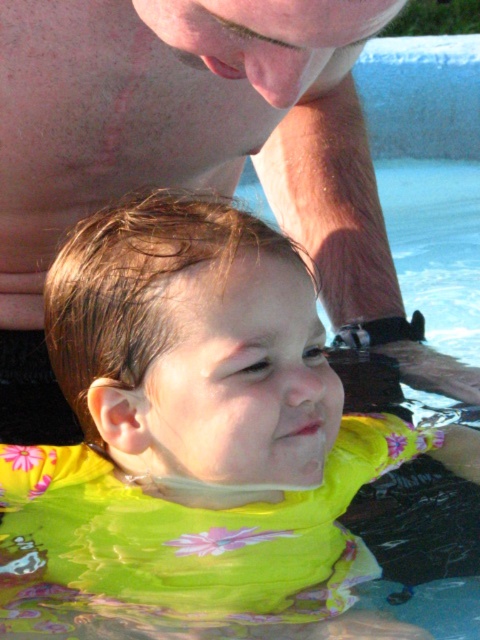
Question: Does yellow fabric float at center have a smaller size compared to pink skin at upper center?

Choices:
 (A) no
 (B) yes

Answer: (B)

Question: Can you confirm if yellow fabric float at center is smaller than pink skin at upper center?

Choices:
 (A) no
 (B) yes

Answer: (B)

Question: Which object appears closest to the camera in this image?

Choices:
 (A) yellow fabric float at center
 (B) pink skin at upper center

Answer: (B)

Question: Is yellow fabric float at center below pink skin at upper center?

Choices:
 (A) no
 (B) yes

Answer: (B)

Question: Which point is farther to the camera?

Choices:
 (A) (339, 509)
 (B) (31, 195)

Answer: (B)

Question: Among these points, which one is nearest to the camera?

Choices:
 (A) (22, 225)
 (B) (140, 492)

Answer: (B)